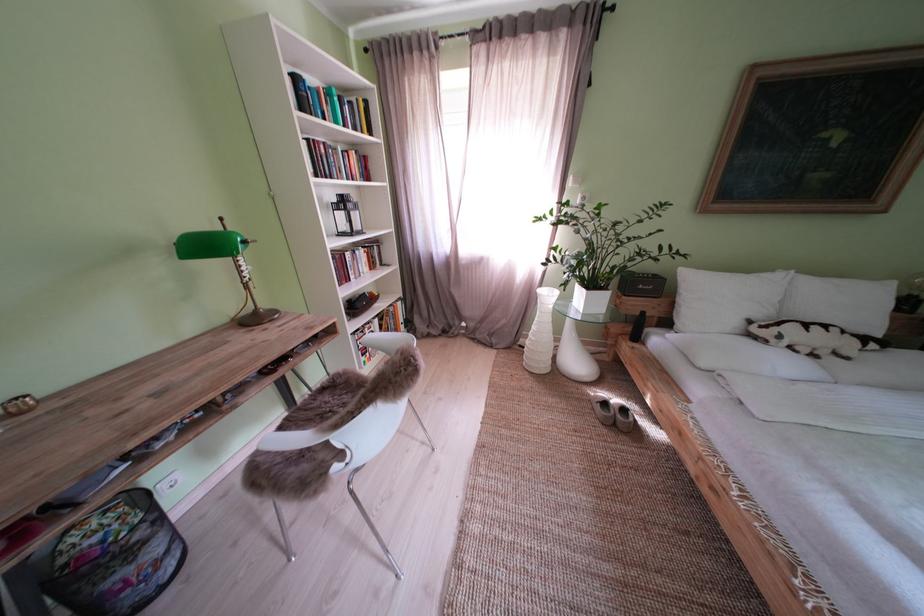
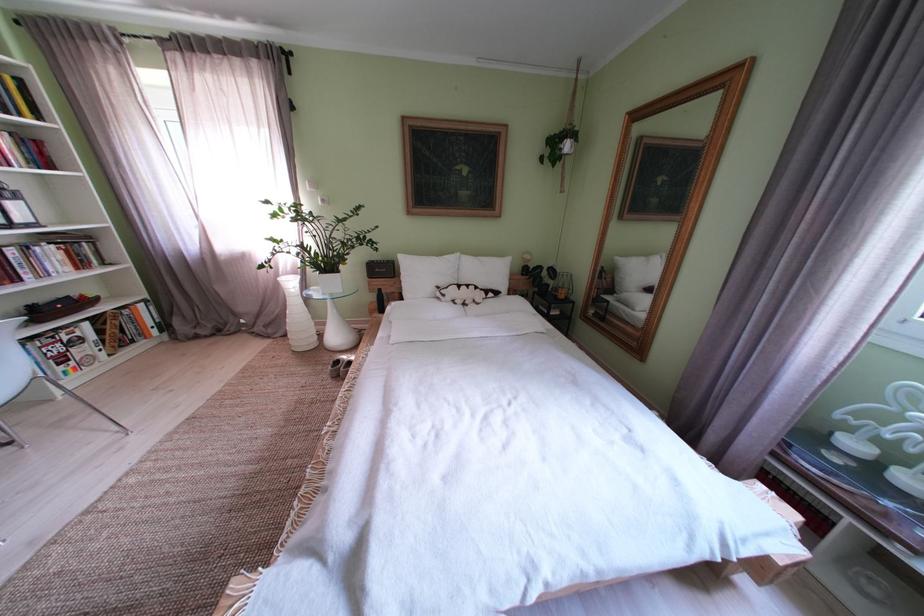
Find the pixel in the second image that matches (365,163) in the first image.

(16, 145)